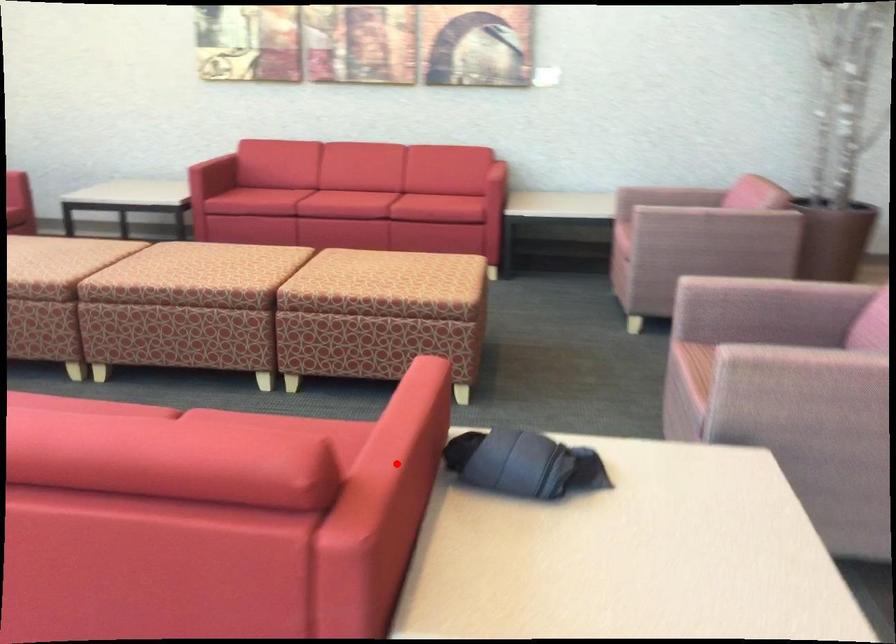
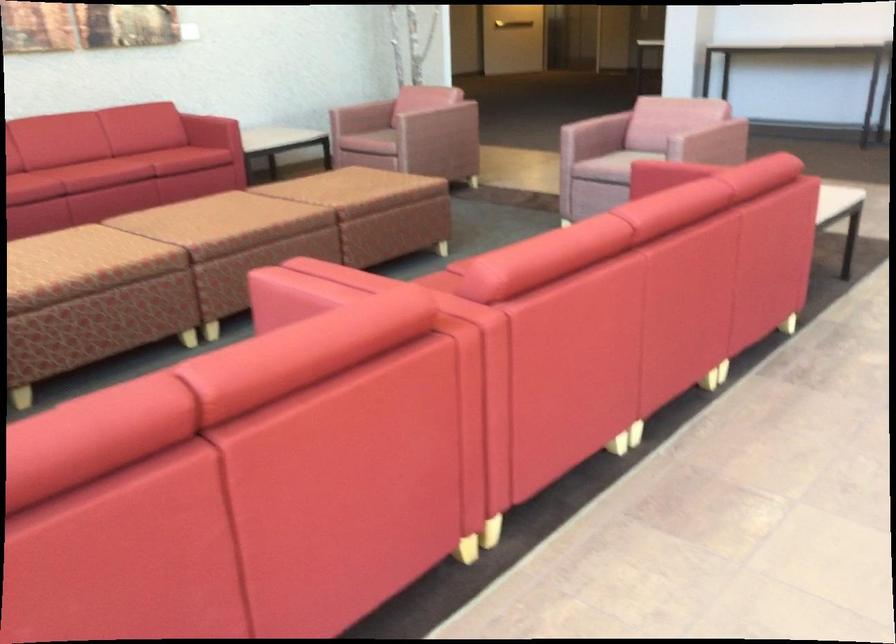
Question: I am providing you with two images of the same scene from different viewpoints. A red point is marked on the first image. Is the red point's position out of view in image 2?

Choices:
 (A) Yes
 (B) No

Answer: (A)